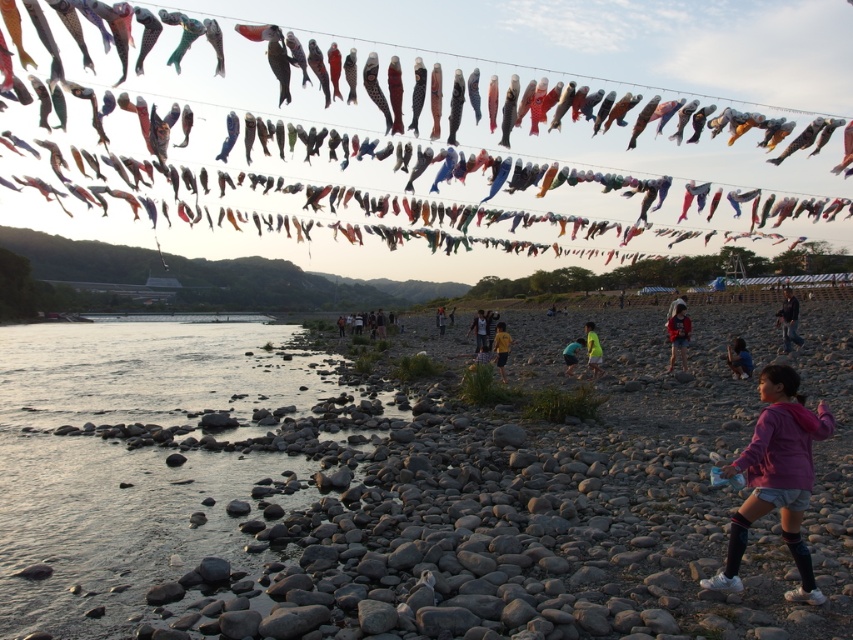
Is purple fleece jacket at lower right further to camera compared to dark blue jacket at lower right?

No, purple fleece jacket at lower right is closer to the viewer.

Can you confirm if purple fleece jacket at lower right is shorter than dark blue jacket at lower right?

Yes, purple fleece jacket at lower right is shorter than dark blue jacket at lower right.

Find the location of a particular element. Image resolution: width=853 pixels, height=640 pixels. purple fleece jacket at lower right is located at coordinates (776, 477).

The width and height of the screenshot is (853, 640). In order to click on purple fleece jacket at lower right in this screenshot , I will do [x=776, y=477].

Between purple fleece jacket at lower right and dark blue shirt at center, which one appears on the left side from the viewer's perspective?

dark blue shirt at center is more to the left.

The image size is (853, 640). I want to click on purple fleece jacket at lower right, so click(776, 477).

The height and width of the screenshot is (640, 853). What are the coordinates of `purple fleece jacket at lower right` in the screenshot? It's located at (776, 477).

Can you confirm if purple fleece jacket at lower right is taller than pink fabric at center?

Yes, purple fleece jacket at lower right is taller than pink fabric at center.

Between purple fleece jacket at lower right and pink fabric at center, which one has more height?

Standing taller between the two is purple fleece jacket at lower right.

Is point (798, 470) positioned before point (683, 344)?

Yes, point (798, 470) is in front of point (683, 344).

Where is `purple fleece jacket at lower right`? purple fleece jacket at lower right is located at coordinates (776, 477).